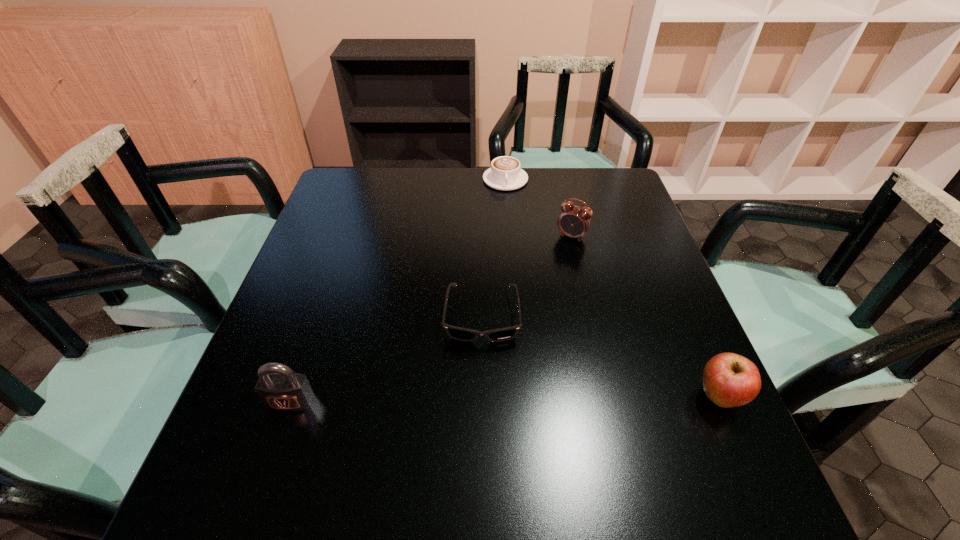
The width and height of the screenshot is (960, 540). Identify the location of padlock. (x=283, y=390).

Where is `the rightmost object`? This screenshot has width=960, height=540. the rightmost object is located at coordinates (730, 380).

You are a GUI agent. You are given a task and a screenshot of the screen. Output one action in this format:
    pyautogui.click(x=<x>, y=<y>)
    Task: Click on the fourth nearest object
    
    Given the screenshot: What is the action you would take?
    pyautogui.click(x=574, y=221)

Identify the location of alarm clock. This screenshot has width=960, height=540. (574, 221).

Image resolution: width=960 pixels, height=540 pixels. I want to click on sunglasses, so click(x=462, y=334).

Locate an element on the screen. the farthest object is located at coordinates (505, 173).

Find the location of a particular element. The width and height of the screenshot is (960, 540). vacant space located on the back of the rightmost object is located at coordinates (693, 336).

Locate an element on the screen. This screenshot has width=960, height=540. vacant region located on the face of the second farthest object is located at coordinates (510, 329).

Identify the location of vacant space located 0.230m on the face of the second farthest object. This screenshot has width=960, height=540. (530, 298).

The width and height of the screenshot is (960, 540). Find the location of `free spot located 0.070m on the face of the second farthest object`. free spot located 0.070m on the face of the second farthest object is located at coordinates (556, 258).